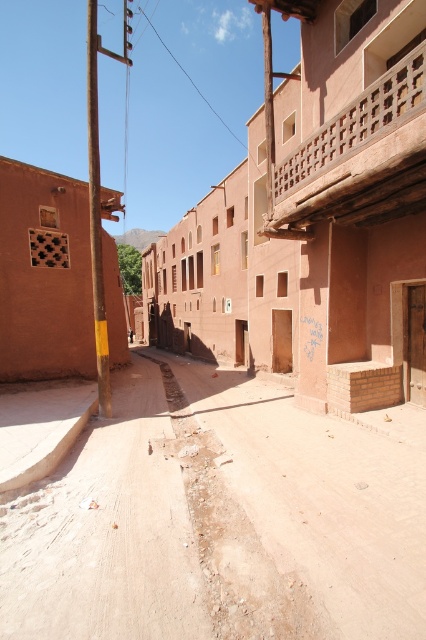
You are a delivery person carrying a heavy box and need to walk through the alleyway shown in the image. There is dull orange dirt at center and a matte clay building at center. Which surface will you step on first as you move forward?

The dull orange dirt at center is in front of the matte clay building at center, so you will step on the dull orange dirt at center first as you move forward.

You are a delivery person carrying a heavy box and need to walk through the alleyway. The path is covered with both dull orange dirt at center and dusty sand at center. Which material will you choose to walk on to avoid sinking deeper into the ground?

The dusty sand at center is smaller in size compared to the dull orange dirt at center, so it will provide better support and prevent sinking. Therefore, you should walk on the dusty sand at center.

You are a delivery person carrying a large package that requires a stable surface to place. You see the matte clay building at center and the dusty sand at center. Which surface would be more suitable for placing your package?

The matte clay building at center is larger in size than the dusty sand at center, so the matte clay building at center would provide a more stable surface for placing your package.